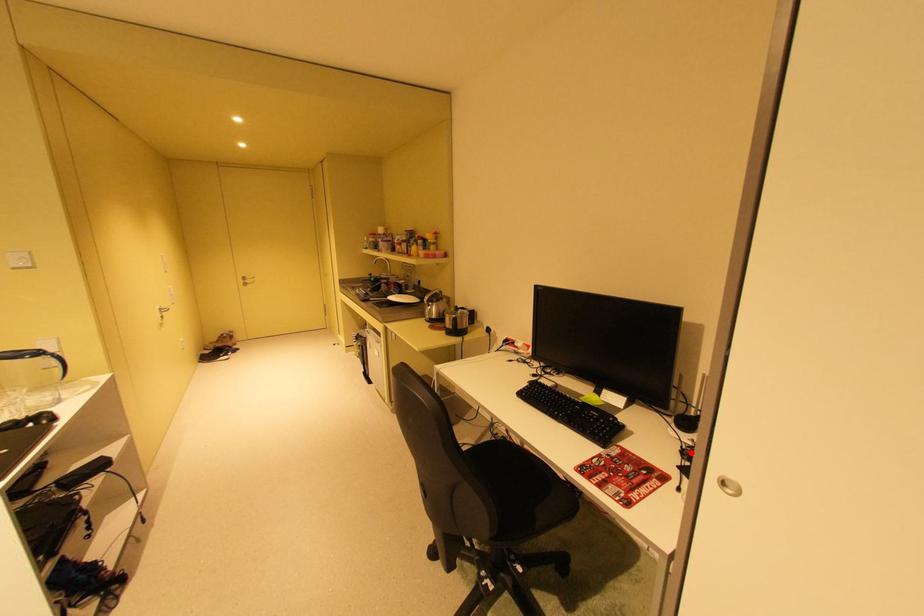
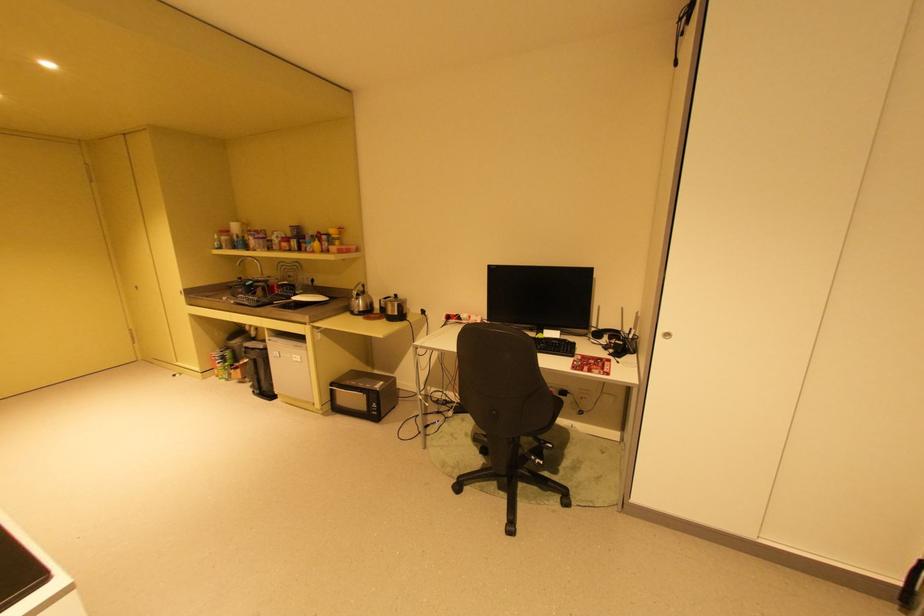
Find the pixel in the second image that matches the highlighted location in the first image.

(614, 349)